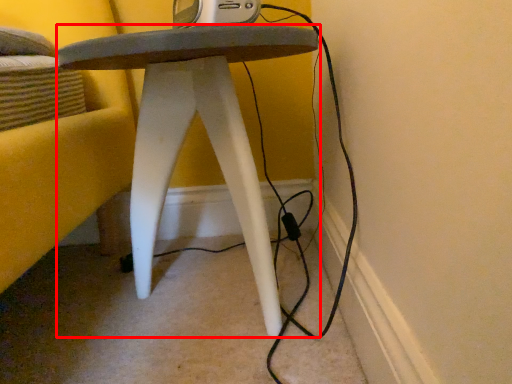
Question: From the image's perspective, where is stool (annotated by the red box) located in relation to gadget in the image?

Choices:
 (A) above
 (B) below

Answer: (B)